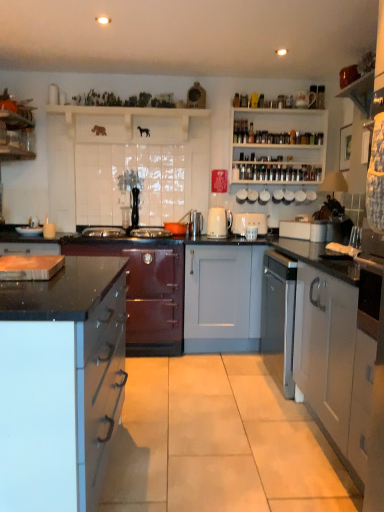
Question: From a real-world perspective, is white ceramic kettle at upper center, the fourth appliance viewed from the left, beneath shiny burgundy cabinet at center-left, the first cabinetry positioned from the back?

Choices:
 (A) no
 (B) yes

Answer: (A)

Question: Is white ceramic kettle at upper center, the fourth appliance viewed from the left, oriented away from shiny burgundy cabinet at center-left, the first cabinetry positioned from the back?

Choices:
 (A) yes
 (B) no

Answer: (B)

Question: Could you tell me if white ceramic kettle at upper center, which is the 2th appliance from right to left, is turned towards shiny burgundy cabinet at center-left, the first cabinetry positioned from the back?

Choices:
 (A) yes
 (B) no

Answer: (B)

Question: Can you confirm if white ceramic kettle at upper center, which is the 2th appliance from right to left, is positioned to the right of shiny burgundy cabinet at center-left, the second cabinetry positioned from the left?

Choices:
 (A) no
 (B) yes

Answer: (B)

Question: Is white ceramic kettle at upper center, which is the 2th appliance from right to left, positioned far away from shiny burgundy cabinet at center-left, which appears as the second cabinetry when viewed from the right?

Choices:
 (A) yes
 (B) no

Answer: (A)

Question: Looking at the image, does white ceramic cup at upper center, the first appliance in the right-to-left sequence, seem bigger or smaller compared to shiny burgundy cabinet at center-left, placed as the 3th cabinetry when sorted from front to back?

Choices:
 (A) big
 (B) small

Answer: (B)

Question: Relative to shiny burgundy cabinet at center-left, the second cabinetry positioned from the left, is white ceramic cup at upper center, the first appliance in the right-to-left sequence, in front or behind?

Choices:
 (A) behind
 (B) front

Answer: (A)

Question: Is white ceramic cup at upper center, which appears as the fifth appliance when viewed from the left, inside or outside of shiny burgundy cabinet at center-left, which appears as the second cabinetry when viewed from the right?

Choices:
 (A) inside
 (B) outside

Answer: (B)

Question: Is point (274, 201) closer or farther from the camera than point (147, 282)?

Choices:
 (A) farther
 (B) closer

Answer: (A)

Question: Looking at their shapes, would you say white ceramic cup at upper center, the first appliance in the right-to-left sequence, is wider or thinner than white wooden shelves at upper right, which ranks as the 1th shelf in right-to-left order?

Choices:
 (A) thin
 (B) wide

Answer: (A)

Question: Which is correct: white ceramic cup at upper center, the first appliance in the right-to-left sequence, is inside white wooden shelves at upper right, which ranks as the 1th shelf in right-to-left order, or outside of it?

Choices:
 (A) outside
 (B) inside

Answer: (B)

Question: Is white ceramic cup at upper center, the first appliance in the right-to-left sequence, bigger or smaller than white wooden shelves at upper right, which is counted as the 2th shelf, starting from the left?

Choices:
 (A) big
 (B) small

Answer: (B)

Question: Considering the relative positions of white ceramic cup at upper center, which appears as the fifth appliance when viewed from the left, and white wooden shelves at upper right, which is counted as the 2th shelf, starting from the left, in the image provided, is white ceramic cup at upper center, which appears as the fifth appliance when viewed from the left, to the left or to the right of white wooden shelves at upper right, which is counted as the 2th shelf, starting from the left,?

Choices:
 (A) left
 (B) right

Answer: (B)

Question: From the image's perspective, relative to white wooden shelves at upper right, which is counted as the 2th shelf, starting from the left, is white ceramic mug at upper center, the 4th appliance positioned from the right, above or below?

Choices:
 (A) above
 (B) below

Answer: (B)

Question: In the image, is white ceramic mug at upper center, marked as the 2th appliance in a left-to-right arrangement, positioned in front of or behind white wooden shelves at upper right, which is counted as the 2th shelf, starting from the left?

Choices:
 (A) behind
 (B) front

Answer: (A)